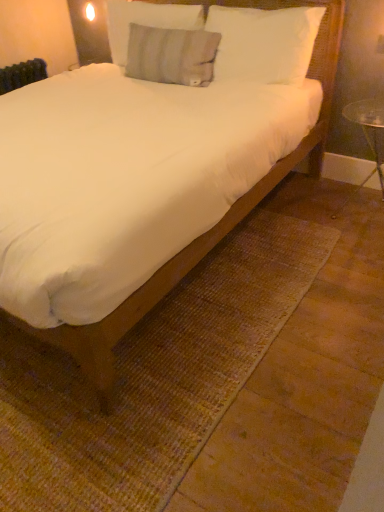
Question: Would you say white soft pillow at upper center, which ranks as the 3th pillow in left-to-right order, contains gray textured pillow at upper center, marked as the 3th pillow in a right-to-left arrangement?

Choices:
 (A) yes
 (B) no

Answer: (B)

Question: Is the position of white soft pillow at upper center, which ranks as the 3th pillow in left-to-right order, more distant than that of gray textured pillow at upper center, marked as the 3th pillow in a right-to-left arrangement?

Choices:
 (A) yes
 (B) no

Answer: (B)

Question: Does white soft pillow at upper center, positioned as the 1th pillow in right-to-left order, have a larger size compared to gray textured pillow at upper center, marked as the 3th pillow in a right-to-left arrangement?

Choices:
 (A) no
 (B) yes

Answer: (B)

Question: Considering the relative sizes of white soft pillow at upper center, positioned as the 1th pillow in right-to-left order, and gray textured pillow at upper center, marked as the 3th pillow in a right-to-left arrangement, in the image provided, is white soft pillow at upper center, positioned as the 1th pillow in right-to-left order, smaller than gray textured pillow at upper center, marked as the 3th pillow in a right-to-left arrangement,?

Choices:
 (A) no
 (B) yes

Answer: (A)

Question: From a real-world perspective, is white soft pillow at upper center, which ranks as the 3th pillow in left-to-right order, located beneath gray textured pillow at upper center, marked as the 3th pillow in a right-to-left arrangement?

Choices:
 (A) no
 (B) yes

Answer: (B)

Question: Could you tell me if white soft pillow at upper center, which ranks as the 3th pillow in left-to-right order, is turned towards gray textured pillow at upper center, positioned as the 1th pillow in left-to-right order?

Choices:
 (A) yes
 (B) no

Answer: (B)

Question: Is white soft bed at center shorter than white soft pillow at upper center, which ranks as the 3th pillow in left-to-right order?

Choices:
 (A) yes
 (B) no

Answer: (B)

Question: Does white soft bed at center have a lesser width compared to white soft pillow at upper center, positioned as the 1th pillow in right-to-left order?

Choices:
 (A) no
 (B) yes

Answer: (A)

Question: Can you confirm if white soft bed at center is taller than white soft pillow at upper center, positioned as the 1th pillow in right-to-left order?

Choices:
 (A) yes
 (B) no

Answer: (A)

Question: Could you tell me if white soft bed at center is turned towards white soft pillow at upper center, positioned as the 1th pillow in right-to-left order?

Choices:
 (A) no
 (B) yes

Answer: (A)

Question: Is white soft bed at center outside of white soft pillow at upper center, positioned as the 1th pillow in right-to-left order?

Choices:
 (A) no
 (B) yes

Answer: (B)

Question: Can you confirm if white soft bed at center is bigger than white soft pillow at upper center, positioned as the 1th pillow in right-to-left order?

Choices:
 (A) yes
 (B) no

Answer: (A)

Question: From a real-world perspective, is white soft pillow at upper center, positioned as the 1th pillow in right-to-left order, physically below gray cotton pillow at upper center, which appears as the second pillow when viewed from the right?

Choices:
 (A) yes
 (B) no

Answer: (B)